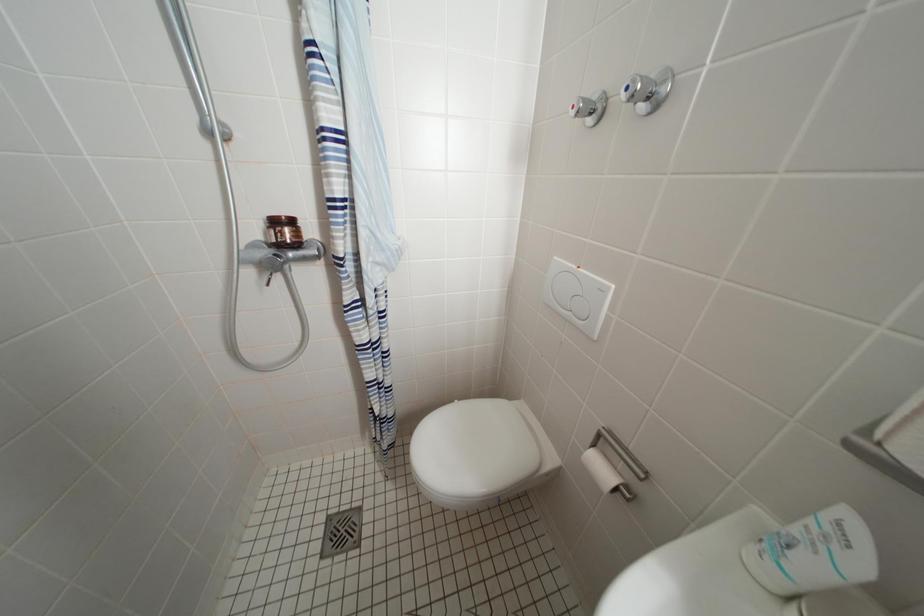
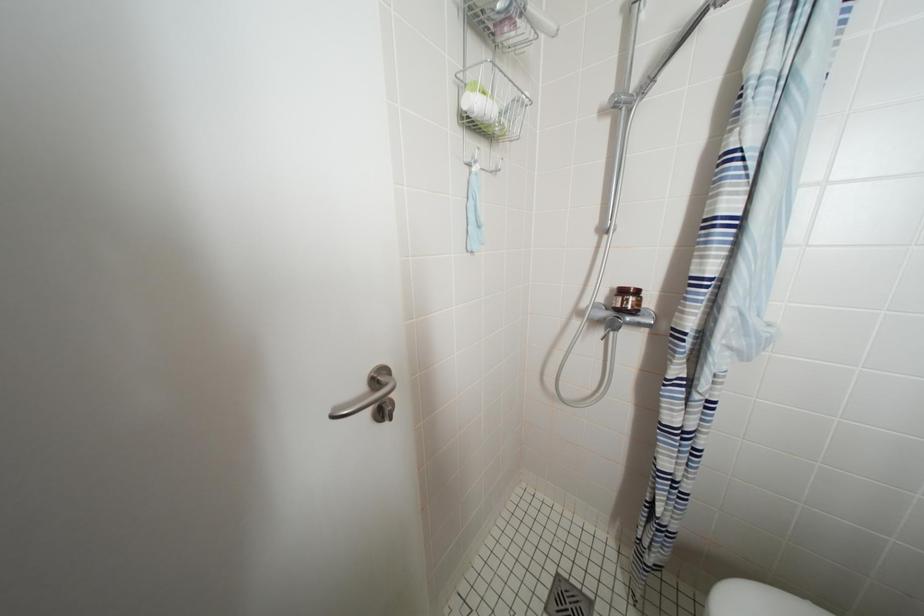
Question: The images are taken continuously from a first-person perspective. In which direction is your viewpoint rotating?

Choices:
 (A) Left
 (B) Right
 (C) Up
 (D) Down

Answer: (A)